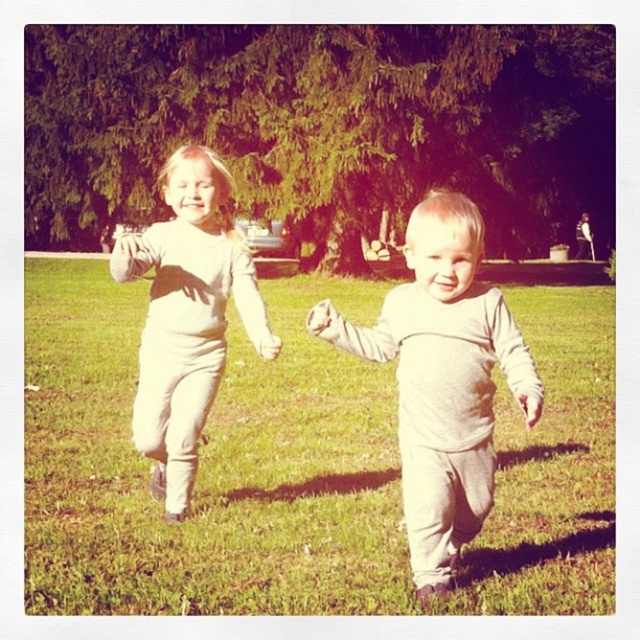
You are a photographer trying to capture a photo of the two children in the scene. You notice the gray cotton onesie at center and the white cotton shirt at upper left. Which clothing item is shorter in height?

The gray cotton onesie at center is not as tall as the white cotton shirt at upper left, so the gray cotton onesie at center is shorter in height.

You are a photographer trying to capture a photo of the children playing in the field. You want to ensure that both the green grass at center and the white cotton shirt at upper left are clearly visible in the shot. Based on their positions, which object should be focused on first to ensure both are in focus?

The green grass at center is in front of the white cotton shirt at upper left, so you should focus on the green grass at center first to ensure both are in focus.